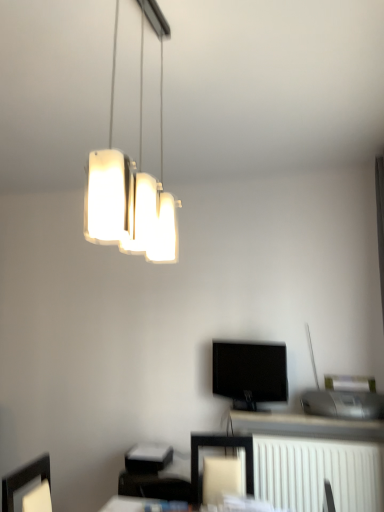
Question: Considering the relative sizes of white plastic radiator at lower right and white matte lamp at upper center in the image provided, is white plastic radiator at lower right smaller than white matte lamp at upper center?

Choices:
 (A) yes
 (B) no

Answer: (B)

Question: Would you say white plastic radiator at lower right is a long distance from white matte lamp at upper center?

Choices:
 (A) no
 (B) yes

Answer: (B)

Question: Considering the relative sizes of white plastic radiator at lower right and white matte lamp at upper center in the image provided, is white plastic radiator at lower right bigger than white matte lamp at upper center?

Choices:
 (A) yes
 (B) no

Answer: (A)

Question: Is white plastic radiator at lower right to the right of white matte lamp at upper center from the viewer's perspective?

Choices:
 (A) no
 (B) yes

Answer: (B)

Question: Can you confirm if white plastic radiator at lower right is thinner than white matte lamp at upper center?

Choices:
 (A) no
 (B) yes

Answer: (A)

Question: Is white plastic radiator at lower right turned away from white matte lamp at upper center?

Choices:
 (A) yes
 (B) no

Answer: (B)

Question: Does white plastic radiator at lower right have a lesser width compared to black glossy tv at center?

Choices:
 (A) no
 (B) yes

Answer: (A)

Question: Does white plastic radiator at lower right have a larger size compared to black glossy tv at center?

Choices:
 (A) yes
 (B) no

Answer: (A)

Question: Does white plastic radiator at lower right have a smaller size compared to black glossy tv at center?

Choices:
 (A) yes
 (B) no

Answer: (B)

Question: From a real-world perspective, is white plastic radiator at lower right on top of black glossy tv at center?

Choices:
 (A) no
 (B) yes

Answer: (A)

Question: Considering the relative positions of white plastic radiator at lower right and black glossy tv at center in the image provided, is white plastic radiator at lower right to the left of black glossy tv at center from the viewer's perspective?

Choices:
 (A) no
 (B) yes

Answer: (A)

Question: Would you say white plastic radiator at lower right is outside black glossy tv at center?

Choices:
 (A) yes
 (B) no

Answer: (A)

Question: Is white plastic radiator at lower right at the back of white matte lamp at upper center?

Choices:
 (A) no
 (B) yes

Answer: (A)